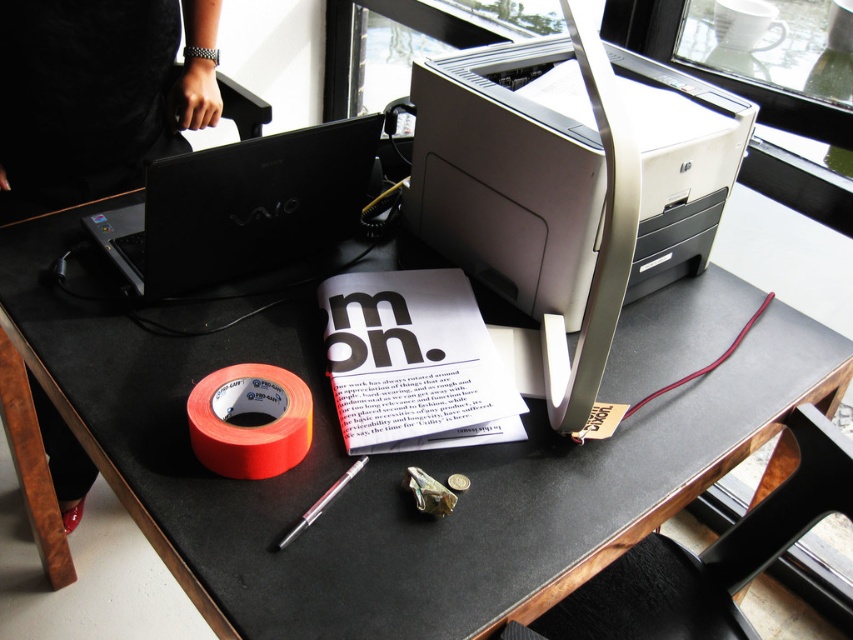
You need to place a rectangular box that is 12 inches wide on the table. The beige plastic printer at center and the orange matte tape at lower left are already on the table. Considering their sizes, which object might you need to move to make space for the box?

The beige plastic printer at center has a larger width than the orange matte tape at lower left. Since the printer is wider, moving it might be necessary to accommodate the 12 inch box, as the tape is narrower and perhaps easier to relocate but the printer occupies more space.

You are organizing the workspace on the dark table and need to move the black matte laptop at upper left closer to the edge. If you move it straight forward, will it end up to the right of the beige plastic printer at center?

The beige plastic printer at center is already to the right of the black matte laptop at upper left. Moving the laptop straight forward won not change its left position relative to the printer. So the laptop would still be to the left of the printer after moving it forward.